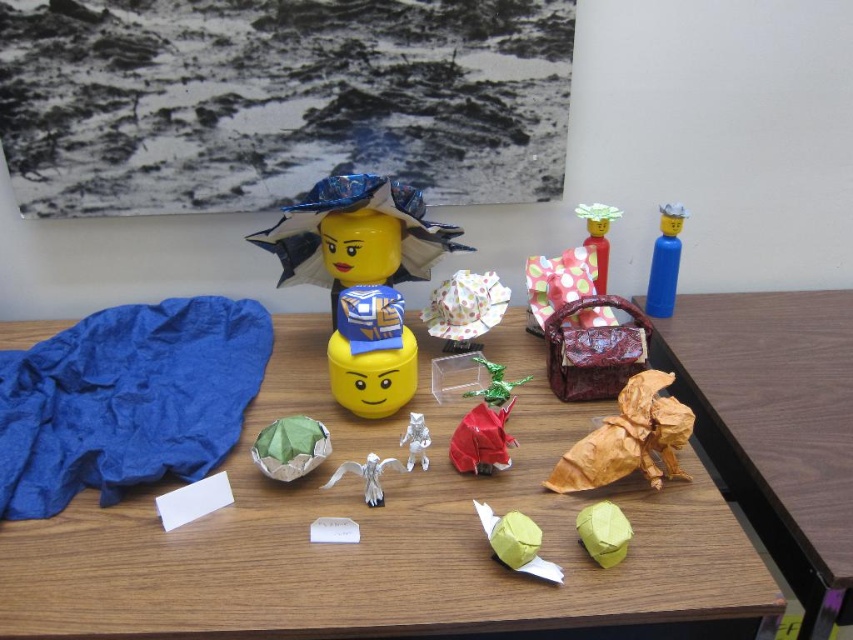
Question: Which is nearer to the yellow matte plastic head at center?

Choices:
 (A) matte yellow paper ball at lower center
 (B) wooden table at center
 (C) wooden origami dog at center
 (D) metallic green dragon at center

Answer: (B)

Question: Which object appears farthest from the camera in this image?

Choices:
 (A) polka dot paper bag at center
 (B) green paper origami at center
 (C) matte green paper at center

Answer: (A)

Question: From the image, what is the correct spatial relationship of matte red origami at center in relation to blue plastic toy at upper right?

Choices:
 (A) above
 (B) below

Answer: (B)

Question: Can you confirm if white paper origami at center is positioned to the left of matte green paper at center?

Choices:
 (A) no
 (B) yes

Answer: (B)

Question: Can you confirm if gold paper sculpture at right is bigger than blue plastic toy at upper right?

Choices:
 (A) yes
 (B) no

Answer: (A)

Question: Which point is closer to the camera taking this photo?

Choices:
 (A) (529, 563)
 (B) (589, 528)
 (C) (111, 602)
 (D) (459, 465)

Answer: (C)